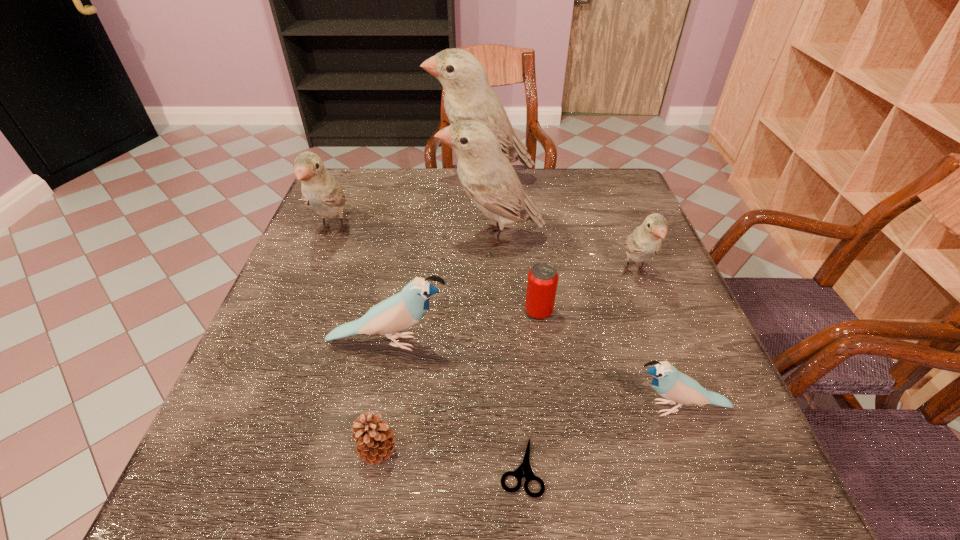
Locate an element on the screen. This screenshot has width=960, height=540. the smaller blue bird is located at coordinates (668, 382).

Locate an element on the screen. The width and height of the screenshot is (960, 540). the third shortest object is located at coordinates (542, 281).

Locate an element on the screen. can is located at coordinates (542, 281).

The width and height of the screenshot is (960, 540). What are the coordinates of `the second shortest object` in the screenshot? It's located at (375, 441).

Identify the location of the shortest object. (524, 469).

Where is `free space located at the face of the tallest bird`? free space located at the face of the tallest bird is located at coordinates (382, 179).

The width and height of the screenshot is (960, 540). I want to click on free spot located at the face of the tallest bird, so coord(359,179).

At what (x,y) coordinates should I click in order to perform the action: click on free space located 0.050m at the face of the tallest bird. Please return your answer as a coordinate pair (x, y). This screenshot has width=960, height=540. Looking at the image, I should click on (413, 179).

I want to click on vacant point located 0.240m at the face of the eighth shortest object, so click(x=346, y=236).

I want to click on free space located at the face of the eighth shortest object, so click(x=394, y=236).